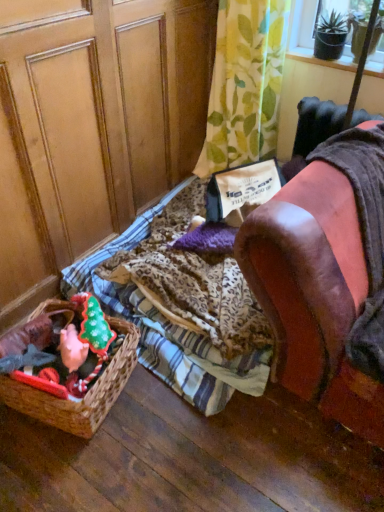
At what (x,y) coordinates should I click in order to perform the action: click on free spot above brown woven basket at lower left (from a real-world perspective). Please return your answer as a coordinate pair (x, y). Looking at the image, I should click on (43, 353).